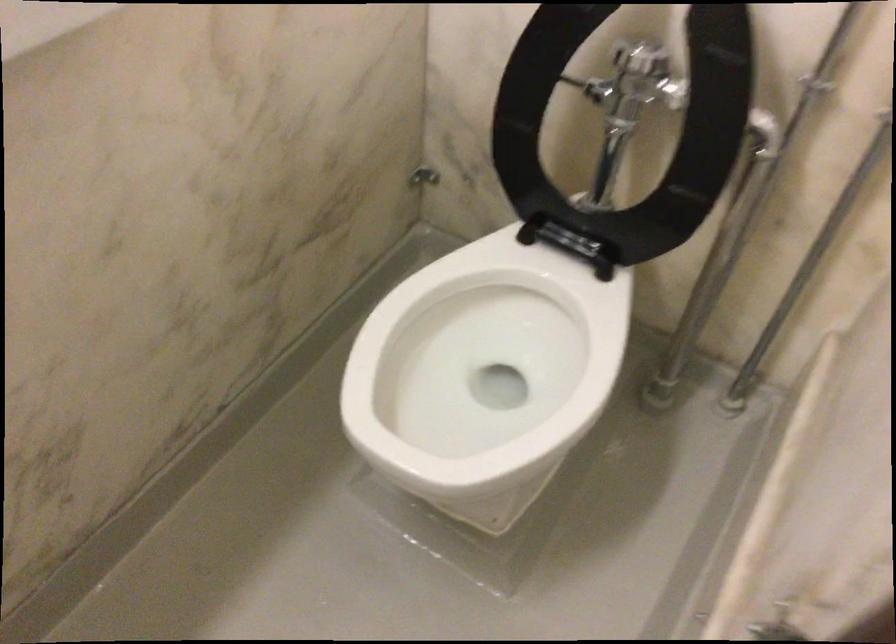
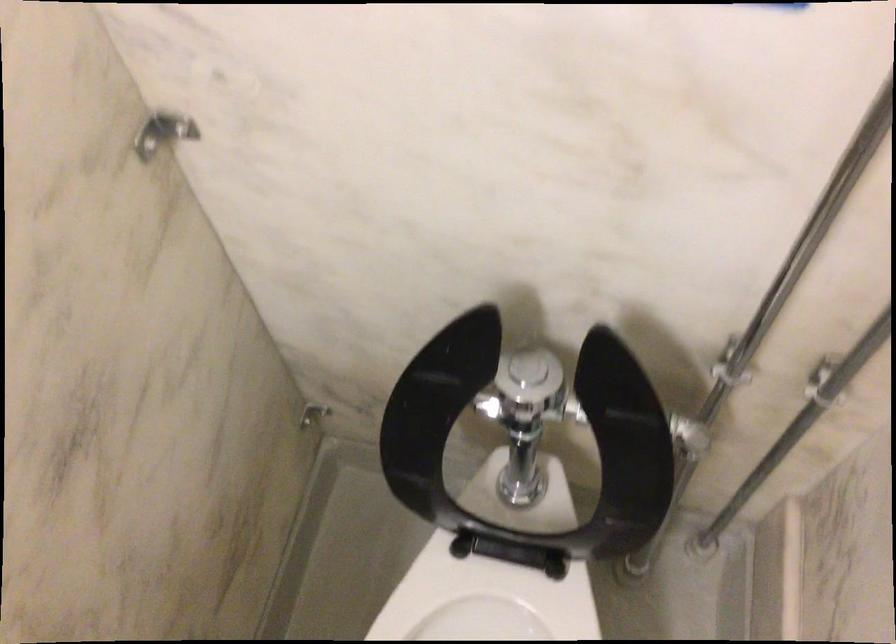
Where in the second image is the point corresponding to pixel 517 308 from the first image?

(487, 605)